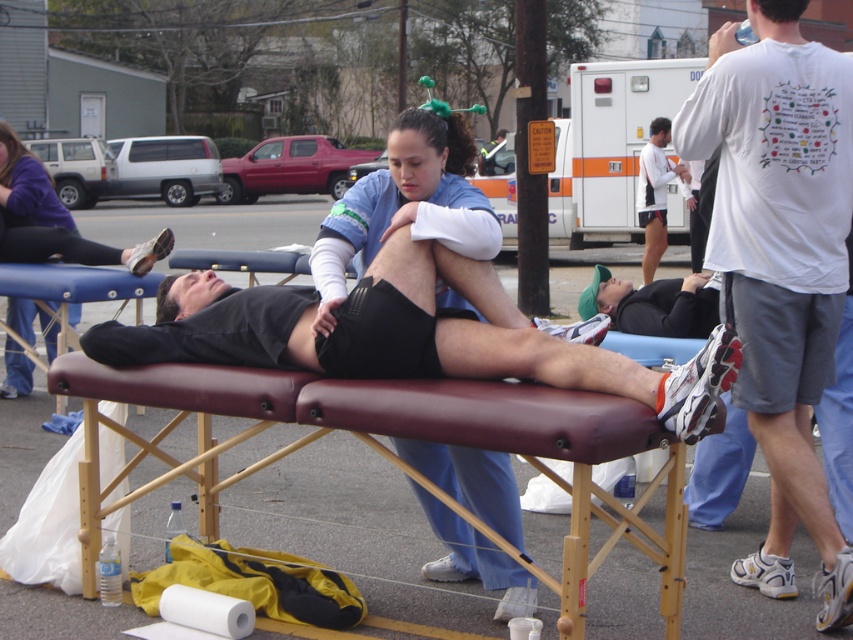
Is maroon leather stretcher at center to the right of black matte shirt at lower right from the viewer's perspective?

Incorrect, maroon leather stretcher at center is not on the right side of black matte shirt at lower right.

Is point (242, 372) more distant than point (660, 282)?

No, (242, 372) is in front of (660, 282).

What are the coordinates of `maroon leather stretcher at center` in the screenshot? It's located at (433, 440).

Where is `maroon leather stretcher at center`? The height and width of the screenshot is (640, 853). maroon leather stretcher at center is located at coordinates (433, 440).

Identify the location of white matte athletic shoe at lower center. (595, 369).

Which is more to the left, white matte athletic shoe at lower center or black matte shirt at lower right?

From the viewer's perspective, white matte athletic shoe at lower center appears more on the left side.

Looking at this image, who is more distant from viewer, (706, 385) or (595, 282)?

Positioned behind is point (595, 282).

You are a GUI agent. You are given a task and a screenshot of the screen. Output one action in this format:
    pyautogui.click(x=<x>, y=<y>)
    Task: Click on the white matte athletic shoe at lower center
    
    Given the screenshot: What is the action you would take?
    pyautogui.click(x=595, y=369)

Which of these two, white/orange ambulance at center or white matte shorts at center, stands shorter?

Standing shorter between the two is white/orange ambulance at center.

Is white/orange ambulance at center wider than white matte shorts at center?

Correct, the width of white/orange ambulance at center exceeds that of white matte shorts at center.

What do you see at coordinates (608, 145) in the screenshot? Image resolution: width=853 pixels, height=640 pixels. I see `white/orange ambulance at center` at bounding box center [608, 145].

You are a GUI agent. You are given a task and a screenshot of the screen. Output one action in this format:
    pyautogui.click(x=<x>, y=<y>)
    Task: Click on the white/orange ambulance at center
    This screenshot has height=640, width=853.
    Given the screenshot: What is the action you would take?
    pyautogui.click(x=608, y=145)